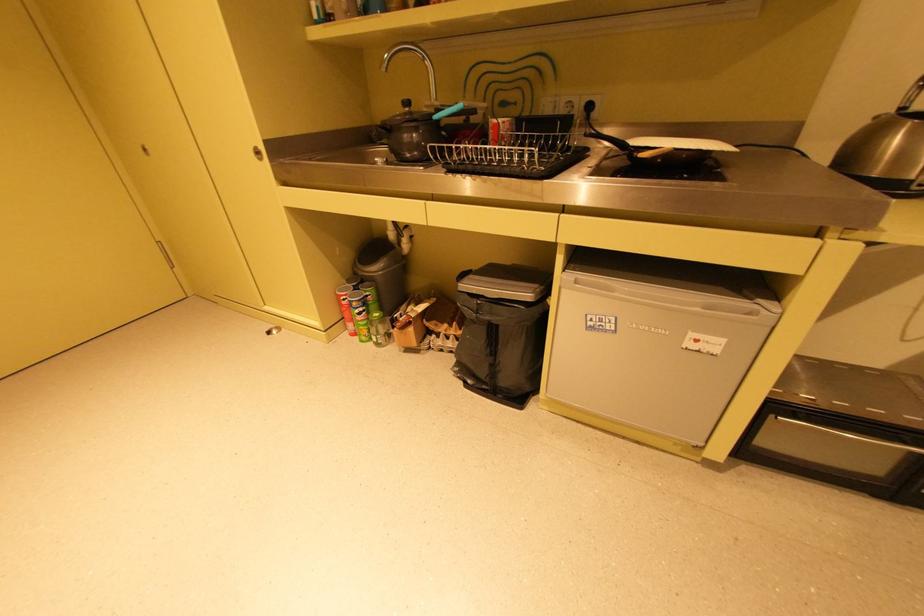
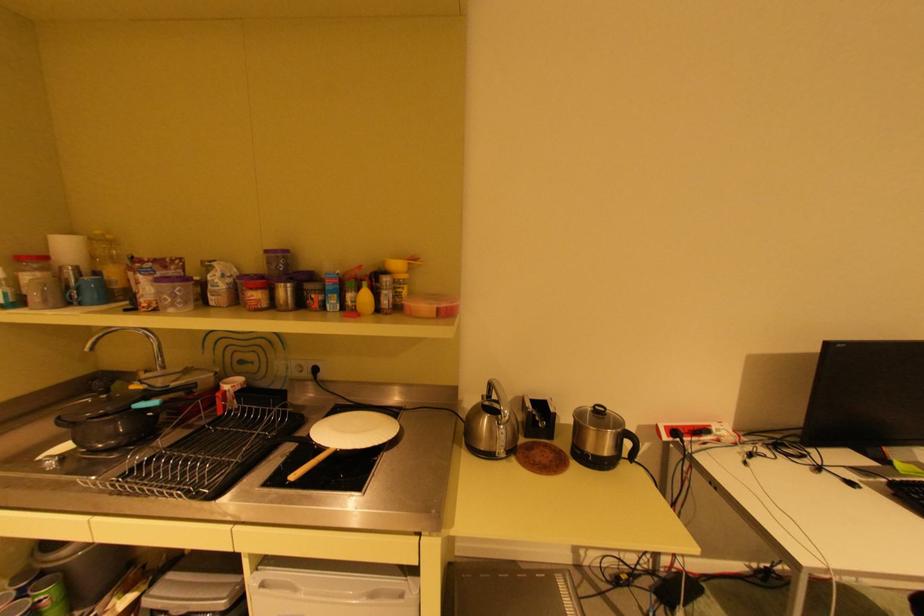
The point at (482, 292) is marked in the first image. Where is the corresponding point in the second image?

(168, 609)